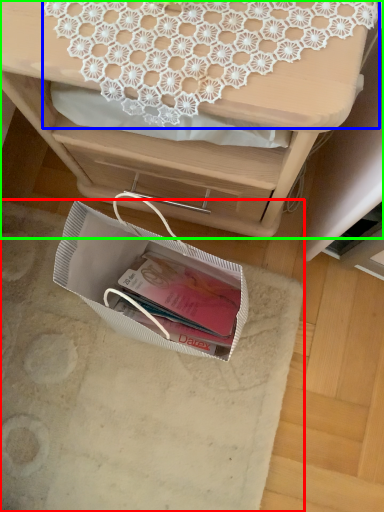
Question: Considering the real-world distances, which object is closest to place mat (highlighted by a red box)? lace (highlighted by a blue box) or desk (highlighted by a green box).

Choices:
 (A) lace
 (B) desk

Answer: (B)